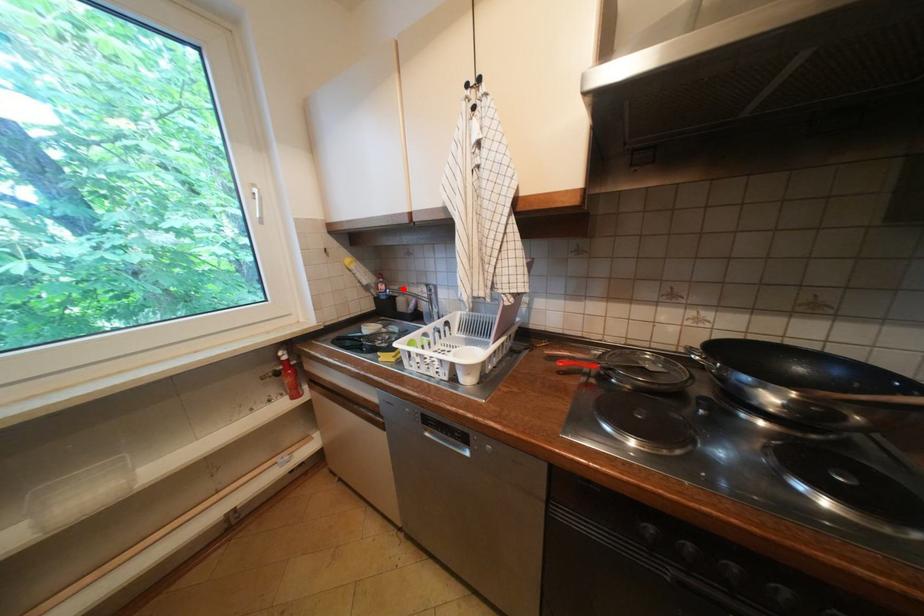
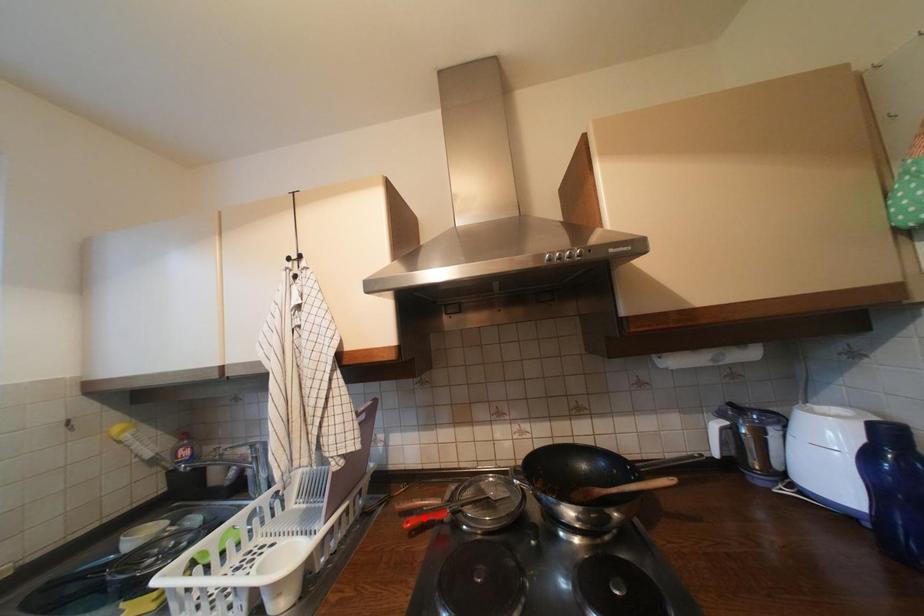
I am providing you with two images of the same scene from different viewpoints. A red point is marked on the first image and another point is marked on the second image. Is the red point in image1 aligned with the point shown in image2?

No